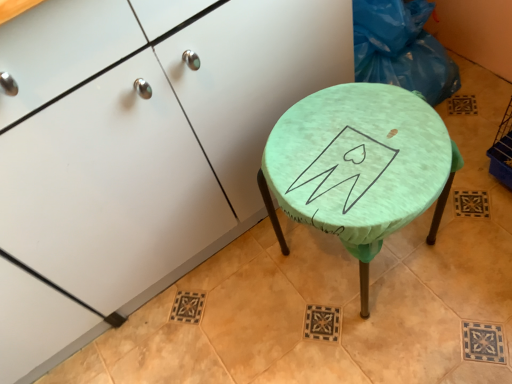
Locate an element on the screen. The image size is (512, 384). free space above green fabric-covered stool at center (from a real-world perspective) is located at coordinates (360, 145).